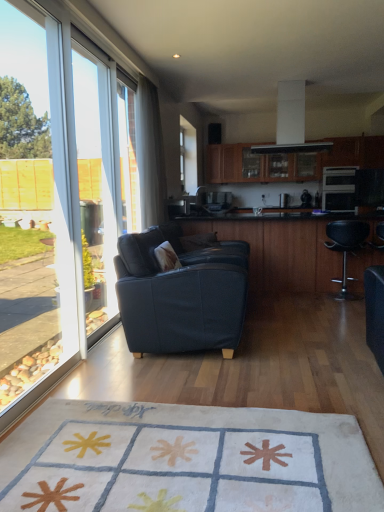
The width and height of the screenshot is (384, 512). Describe the element at coordinates (37, 215) in the screenshot. I see `transparent glass window at left` at that location.

The image size is (384, 512). Identify the location of white sheer curtain at left. (150, 155).

Where is `white soft rug at center`? The width and height of the screenshot is (384, 512). white soft rug at center is located at coordinates (185, 460).

The width and height of the screenshot is (384, 512). What do you see at coordinates (278, 250) in the screenshot?
I see `black glossy table at center` at bounding box center [278, 250].

This screenshot has width=384, height=512. What do you see at coordinates (290, 161) in the screenshot?
I see `wooden cabinet at upper center` at bounding box center [290, 161].

The image size is (384, 512). I want to click on transparent glass door at left, so click(x=97, y=177).

Based on the photo, considering the sizes of objects white glossy exhaust hood at upper center and transparent glass window at left in the image provided, who is taller, white glossy exhaust hood at upper center or transparent glass window at left?

transparent glass window at left is taller.

Based on their sizes in the image, would you say white glossy exhaust hood at upper center is bigger or smaller than transparent glass window at left?

white glossy exhaust hood at upper center is smaller than transparent glass window at left.

Image resolution: width=384 pixels, height=512 pixels. I want to click on exhaust hood on the right of the transparent glass window at left, so click(291, 122).

Is white glossy exhaust hood at upper center not close to transparent glass window at left?

That's right, there is a large distance between white glossy exhaust hood at upper center and transparent glass window at left.

Considering the sizes of objects white glossy exhaust hood at upper center and dark blue fabric couch at center in the image provided, who is thinner, white glossy exhaust hood at upper center or dark blue fabric couch at center?

Thinner between the two is white glossy exhaust hood at upper center.

Considering the sizes of white glossy exhaust hood at upper center and dark blue fabric couch at center in the image, is white glossy exhaust hood at upper center bigger or smaller than dark blue fabric couch at center?

white glossy exhaust hood at upper center is smaller than dark blue fabric couch at center.

From a real-world perspective, is white glossy exhaust hood at upper center located beneath dark blue fabric couch at center?

No, from a real-world perspective, white glossy exhaust hood at upper center is not beneath dark blue fabric couch at center.

Considering the relative sizes of white glossy exhaust hood at upper center and dark blue fabric couch at center in the image provided, is white glossy exhaust hood at upper center taller than dark blue fabric couch at center?

No.

Consider the image. Are white sheer curtain at left and dark blue fabric couch at center located far from each other?

Yes, white sheer curtain at left is far from dark blue fabric couch at center.

Which object is thinner, white sheer curtain at left or dark blue fabric couch at center?

Thinner between the two is white sheer curtain at left.

Is white sheer curtain at left not within dark blue fabric couch at center?

Indeed, white sheer curtain at left is completely outside dark blue fabric couch at center.

Is white sheer curtain at left positioned with its back to dark blue fabric couch at center?

No, white sheer curtain at left's orientation is not away from dark blue fabric couch at center.

Considering the sizes of objects transparent glass window screen at left and white sheer curtain at left in the image provided, who is bigger, transparent glass window screen at left or white sheer curtain at left?

Bigger between the two is white sheer curtain at left.

From the image's perspective, is transparent glass window screen at left positioned above or below white sheer curtain at left?

transparent glass window screen at left is below white sheer curtain at left.

Can you confirm if transparent glass window screen at left is thinner than white sheer curtain at left?

Yes.

Does point (129, 129) come closer to viewer compared to point (147, 102)?

Yes, it is.

Can you confirm if transparent glass door at left is positioned to the left of black leather bar stool at right?

Indeed, transparent glass door at left is positioned on the left side of black leather bar stool at right.

I want to click on chair to the right of transparent glass door at left, so click(346, 249).

From the image's perspective, is transparent glass door at left positioned above or below black leather bar stool at right?

Based on their image positions, transparent glass door at left is located above black leather bar stool at right.

Which is less distant, (x=59, y=316) or (x=278, y=131)?

Point (x=59, y=316) is closer to the camera than point (x=278, y=131).

From the image's perspective, which is below, transparent glass window at left or white glossy exhaust hood at upper center?

transparent glass window at left, from the image's perspective.

Considering the relative positions of transparent glass window at left and white glossy exhaust hood at upper center in the image provided, is transparent glass window at left to the left of white glossy exhaust hood at upper center from the viewer's perspective?

Yes.

What's the angular difference between transparent glass window at left and white glossy exhaust hood at upper center's facing directions?

The angle between the facing direction of transparent glass window at left and the facing direction of white glossy exhaust hood at upper center is 90.5 degrees.

Is transparent glass window at left further to the viewer compared to black leather bar stool at right?

No, it is in front of black leather bar stool at right.

Does transparent glass window at left have a larger size compared to black leather bar stool at right?

Correct, transparent glass window at left is larger in size than black leather bar stool at right.

From a real-world perspective, which is physically below, transparent glass window at left or black leather bar stool at right?

From a 3D spatial view, black leather bar stool at right is below.

Is transparent glass window at left oriented away from black leather bar stool at right?

That's not correct — transparent glass window at left is not looking away from black leather bar stool at right.

Locate an element on the screen. The height and width of the screenshot is (512, 384). exhaust hood above the transparent glass window at left (from the image's perspective) is located at coordinates (291, 122).

Identify the location of studio couch in front of the white glossy exhaust hood at upper center. Image resolution: width=384 pixels, height=512 pixels. (180, 294).

Considering their positions, is transparent glass window at left positioned closer to white sheer curtain at left than white soft rug at center?

Based on the image, transparent glass window at left appears to be nearer to white sheer curtain at left.

Based on their spatial positions, is dark blue fabric couch at center or white glossy exhaust hood at upper center further from transparent glass door at left?

Based on the image, white glossy exhaust hood at upper center appears to be further to transparent glass door at left.

Estimate the real-world distances between objects in this image. Which object is closer to black glossy table at center, white soft rug at center or black leather bar stool at right?

black leather bar stool at right is positioned closer to the anchor black glossy table at center.

Consider the image. Looking at the image, which one is located further to white glossy exhaust hood at upper center, transparent glass door at left or wooden cabinet at upper center?

Based on the image, transparent glass door at left appears to be further to white glossy exhaust hood at upper center.

Based on their spatial positions, is wooden cabinet at upper center or black glossy table at center closer to white glossy exhaust hood at upper center?

wooden cabinet at upper center.

When comparing their distances from white soft rug at center, does wooden cabinet at upper center or black glossy table at center seem further?

wooden cabinet at upper center is positioned further to the anchor white soft rug at center.

Based on their spatial positions, is white soft rug at center or black glossy table at center further from transparent glass window at left?

black glossy table at center is positioned further to the anchor transparent glass window at left.

Estimate the real-world distances between objects in this image. Which object is closer to white soft rug at center, transparent glass window screen at left or black glossy table at center?

Among the two, transparent glass window screen at left is located nearer to white soft rug at center.

The width and height of the screenshot is (384, 512). What are the coordinates of `studio couch located between transparent glass door at left and black glossy table at center in the left-right direction` in the screenshot? It's located at (180, 294).

Locate an element on the screen. Image resolution: width=384 pixels, height=512 pixels. exhaust hood located between transparent glass window screen at left and black leather bar stool at right in the left-right direction is located at coordinates (291, 122).

Where is `chair located between transparent glass window at left and wooden cabinet at upper center in the depth direction`? The width and height of the screenshot is (384, 512). chair located between transparent glass window at left and wooden cabinet at upper center in the depth direction is located at coordinates (346, 249).

Where is `glass door positioned between white soft rug at center and white glossy exhaust hood at upper center from near to far`? The height and width of the screenshot is (512, 384). glass door positioned between white soft rug at center and white glossy exhaust hood at upper center from near to far is located at coordinates (x=97, y=177).